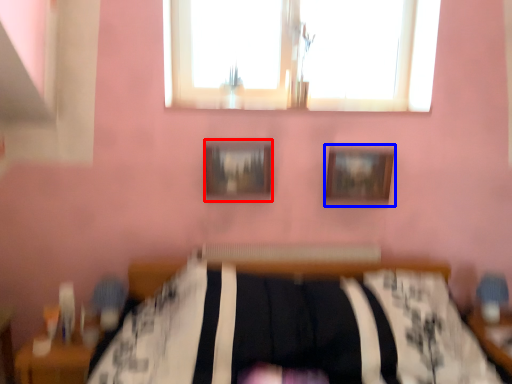
Question: Which point is closer to the camera, picture frame (highlighted by a red box) or picture frame (highlighted by a blue box)?

Choices:
 (A) picture frame
 (B) picture frame

Answer: (A)